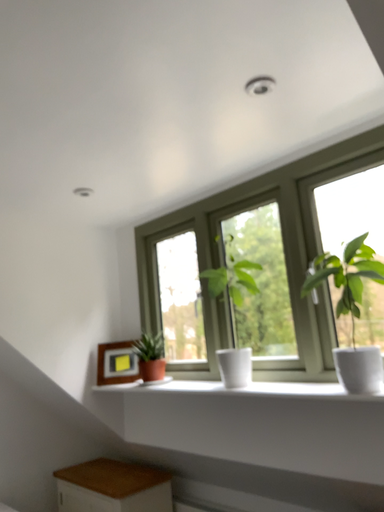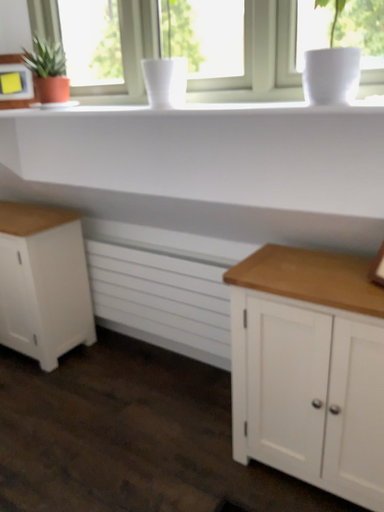
Question: How did the camera likely rotate when shooting the video?

Choices:
 (A) rotated right
 (B) rotated left

Answer: (A)